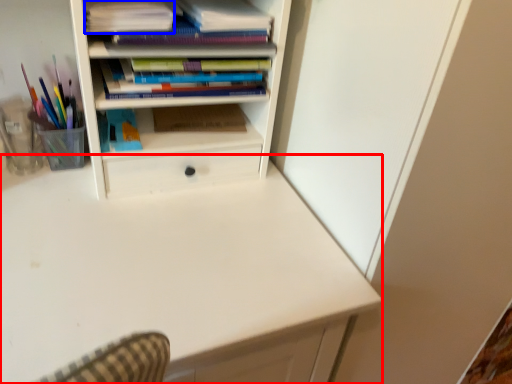
Question: Among these objects, which one is nearest to the camera, computer desk (highlighted by a red box) or book (highlighted by a blue box)?

Choices:
 (A) computer desk
 (B) book

Answer: (A)